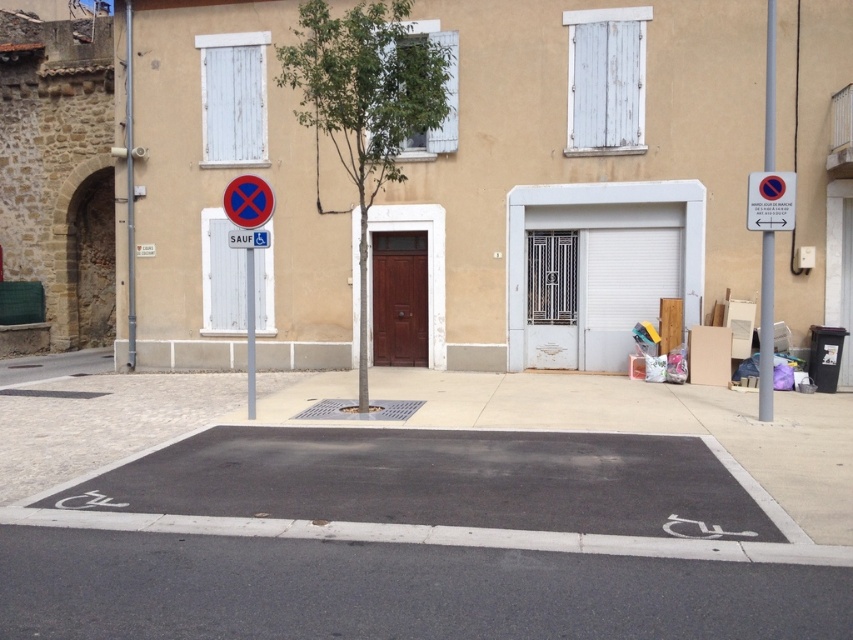
Based on the photo, you are a delivery driver who needs to park in the parking space. The parking space has a reserved sign for disabled individuals. There are two metallic objects nearby, a metallic signpost at right and a metallic pole at left. Which one is shorter?

The metallic signpost at right has a lesser height compared to the metallic pole at left, so the metallic signpost at right is shorter.

You are a delivery person who needs to park your van in the parking space marked for disabled individuals. However, you notice the white matte garage door at center is partially open. Can you safely park your van in that spot without blocking the garage door?

The white matte garage door at center is partially open, so parking the van in the disabled parking spot might block the garage door. It is not advisable to park there as it could obstruct access to the garage.